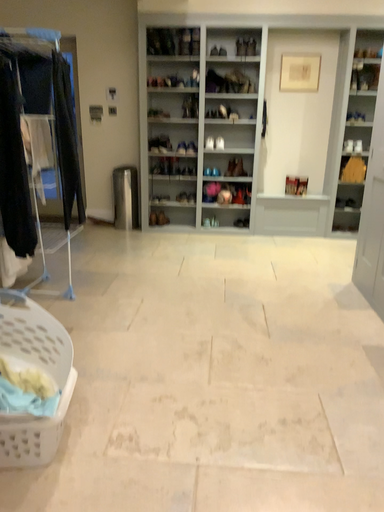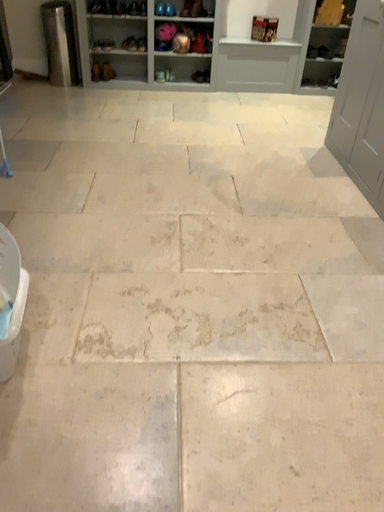
Question: Which way did the camera rotate in the video?

Choices:
 (A) rotated upward
 (B) rotated downward

Answer: (B)